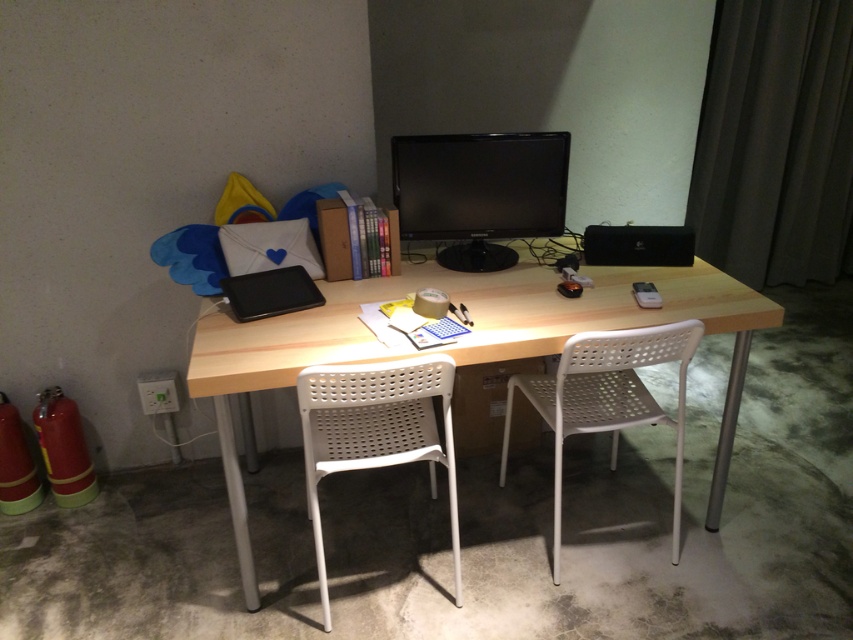
Question: Does black glossy monitor at center appear under black matte laptop at center?

Choices:
 (A) yes
 (B) no

Answer: (B)

Question: Does black glossy monitor at center have a greater width compared to white perforated chair at center?

Choices:
 (A) yes
 (B) no

Answer: (A)

Question: Among these points, which one is nearest to the camera?

Choices:
 (A) (610, 305)
 (B) (482, 262)

Answer: (A)

Question: Which object is farther from the camera taking this photo?

Choices:
 (A) white perforated chair at center
 (B) black matte laptop at center
 (C) natural wood desk at center
 (D) white plastic chair at center

Answer: (B)

Question: Based on their relative distances, which object is farther from the natural wood desk at center?

Choices:
 (A) white plastic chair at center
 (B) white perforated chair at center
 (C) black glossy monitor at center

Answer: (A)

Question: Does natural wood desk at center have a lesser width compared to black glossy monitor at center?

Choices:
 (A) yes
 (B) no

Answer: (B)